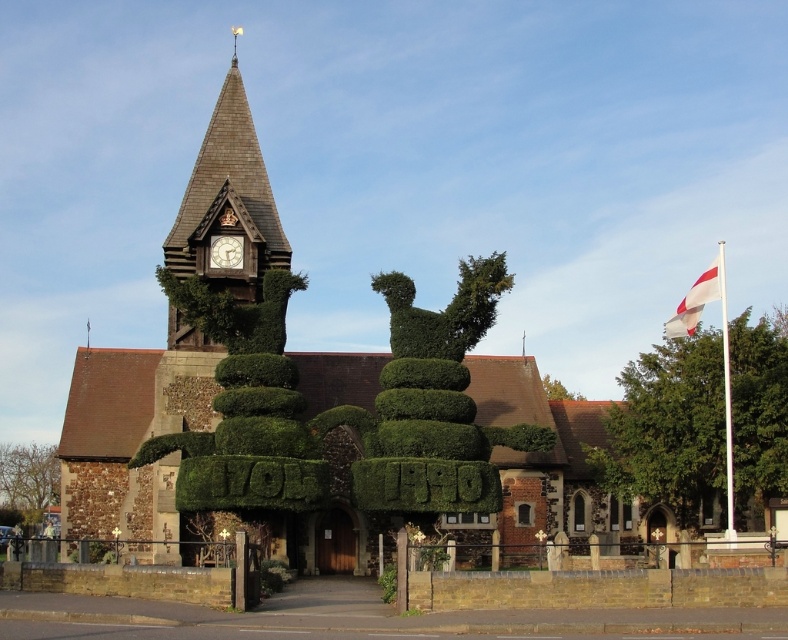
You are standing at the entrance of the church and want to take a photo of the green leafy tree at right. If your camera has a maximum zoom range of 200 feet, will you be able to capture the tree clearly without moving closer?

The green leafy tree at right is 253.48 feet away from the viewer. Since the camera can only zoom up to 200 feet, it won cannot capture the tree clearly without moving closer.

You are standing in front of the church and want to take a photo that includes both the clock tower and the lion topiary. The camera can only focus on objects within a certain distance from the camera. If the camera can focus on objects up to 10 meters away, will both the point at point (675, 419) and point (6, 477) be in focus?

Point (675, 419) is closer to the camera than point (6, 477). Since the camera can focus up to 10 meters, both points will be within the focus range as long as the closer point is within 10 meters. However, the exact distances aren

You are a landscape architect designing a garden path that needs to pass between the green leafy tree at right and the green leafy bush at lower left. If the path must be at least 2 meters wide to accommodate a wheelbarrow, can the space between them accommodate this requirement?

The green leafy tree at right is wider than the green leafy bush at lower left, but the description does not provide specific measurements of the distance between them. Therefore, it is impossible to determine if the path will be wide enough based on the given information.